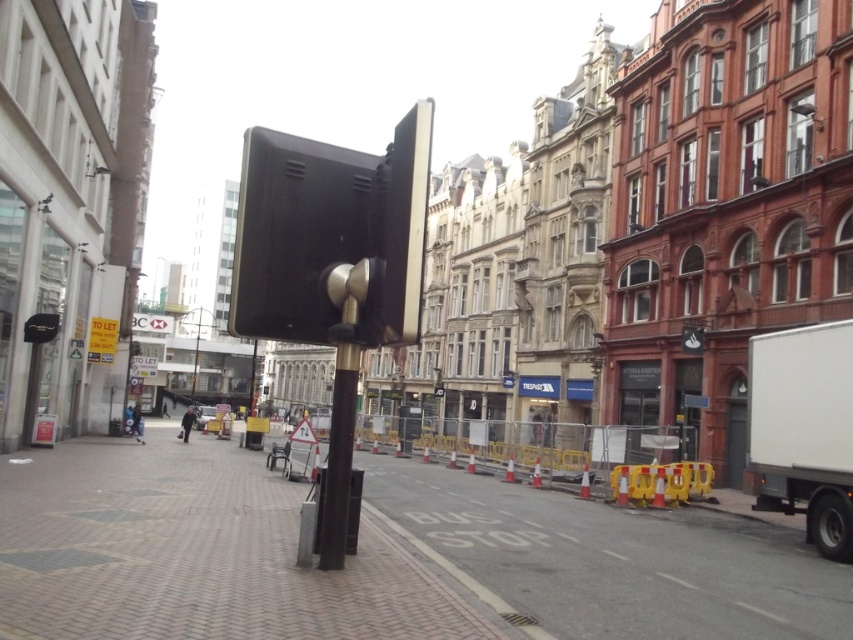
Question: In this image, where is brick pavement at center located relative to black plastic traffic light at center?

Choices:
 (A) right
 (B) left

Answer: (B)

Question: Does black plastic traffic light at center come behind black matte pole at center?

Choices:
 (A) yes
 (B) no

Answer: (B)

Question: Among these points, which one is nearest to the camera?

Choices:
 (A) (378, 568)
 (B) (843, 342)

Answer: (A)

Question: Is white matte truck at right to the right of black matte pole at center from the viewer's perspective?

Choices:
 (A) no
 (B) yes

Answer: (B)

Question: Which point is farther to the camera?

Choices:
 (A) (378, 243)
 (B) (337, 528)
 (C) (788, 349)

Answer: (C)

Question: Which point is closer to the camera?

Choices:
 (A) (335, 502)
 (B) (56, 566)
 (C) (836, 476)
 (D) (328, 317)

Answer: (B)